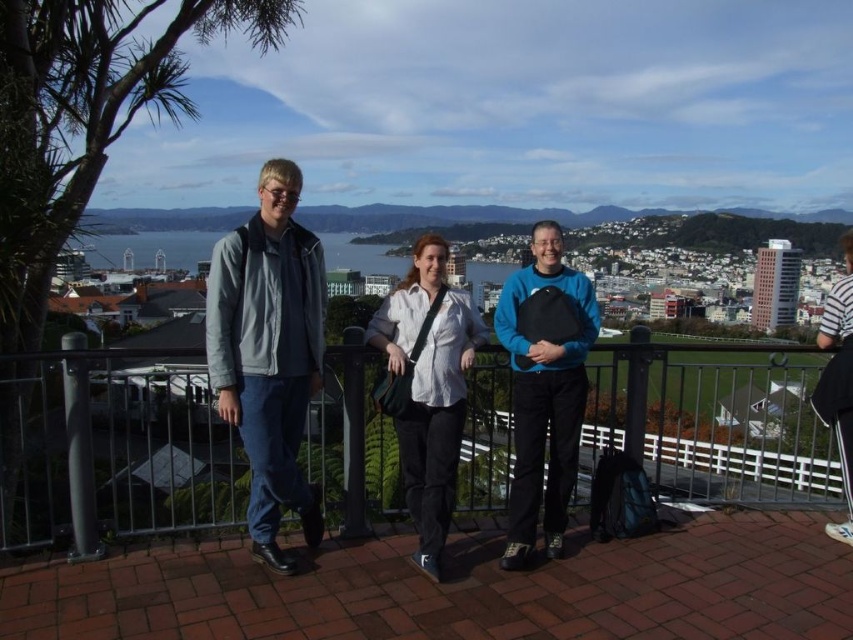
Question: Can you confirm if black metal railing at center is smaller than white striped shirt at upper right?

Choices:
 (A) yes
 (B) no

Answer: (B)

Question: Which point appears closest to the camera in this image?

Choices:
 (A) (413, 330)
 (B) (285, 218)
 (C) (824, 316)
 (D) (45, 362)

Answer: (D)

Question: Is black metal railing at center to the left of white striped shirt at upper right from the viewer's perspective?

Choices:
 (A) yes
 (B) no

Answer: (A)

Question: Which point appears farthest from the camera in this image?

Choices:
 (A) (283, 324)
 (B) (581, 368)

Answer: (B)

Question: Can you confirm if black metal railing at center is positioned to the left of white striped shirt at upper right?

Choices:
 (A) yes
 (B) no

Answer: (A)

Question: Which object appears closest to the camera in this image?

Choices:
 (A) black metal railing at center
 (B) white striped shirt at upper right
 (C) light gray fabric jacket at center
 (D) teal matte sweater at center

Answer: (A)